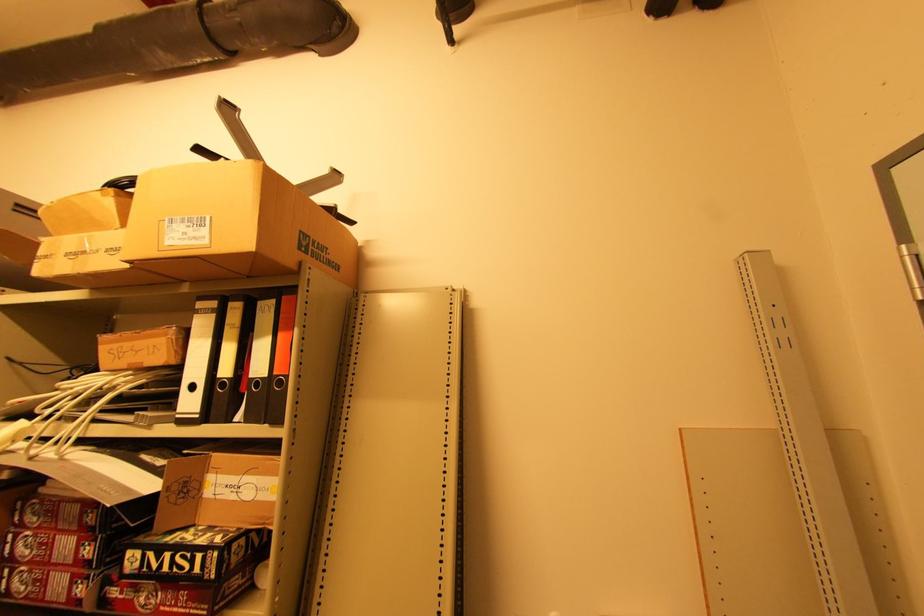
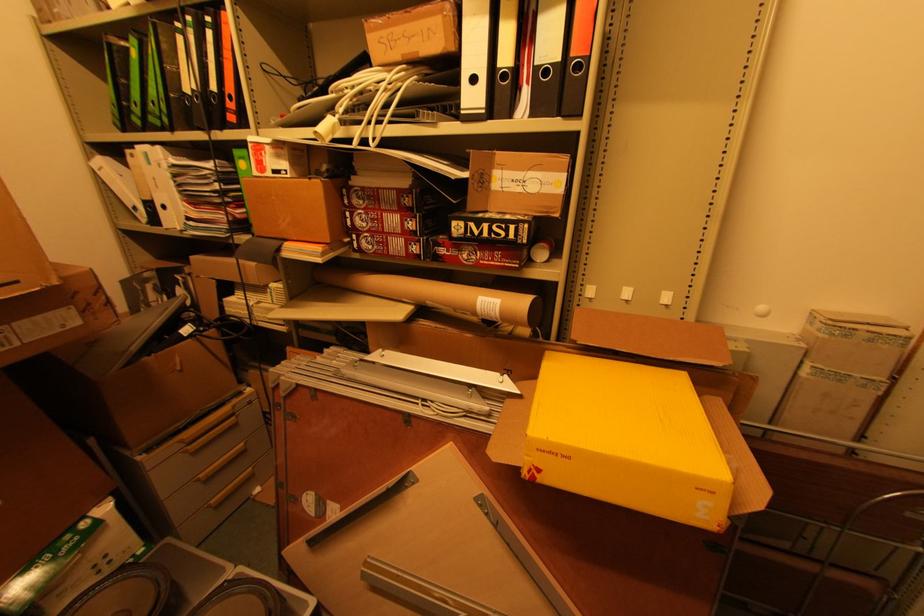
Question: How did the camera likely rotate?

Choices:
 (A) Left
 (B) Right
 (C) Up
 (D) Down

Answer: (D)